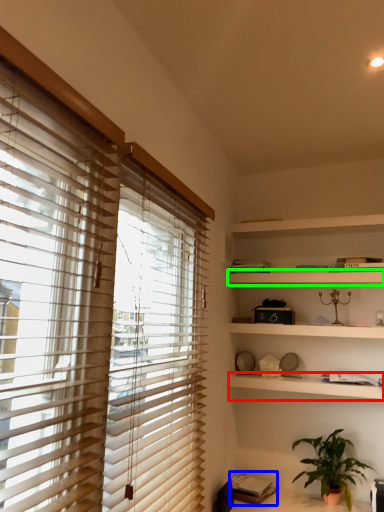
Question: Estimate the real-world distances between objects in this image. Which object is farther from shelf (highlighted by a red box), book (highlighted by a blue box) or shelf (highlighted by a green box)?

Choices:
 (A) book
 (B) shelf

Answer: (A)